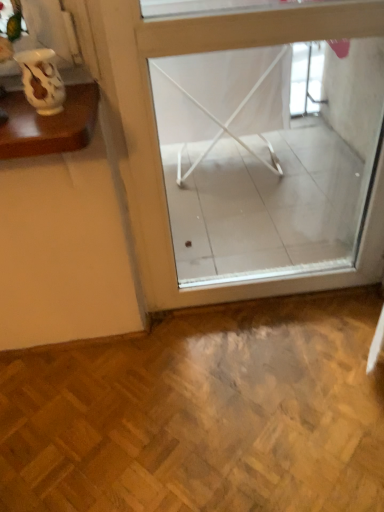
In order to click on vacant region under transparent glass window at center (from a real-world perspective) in this screenshot , I will do `click(281, 298)`.